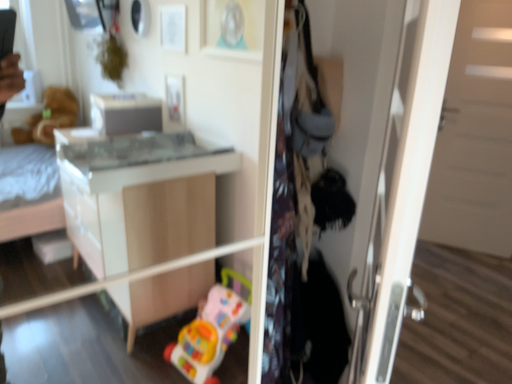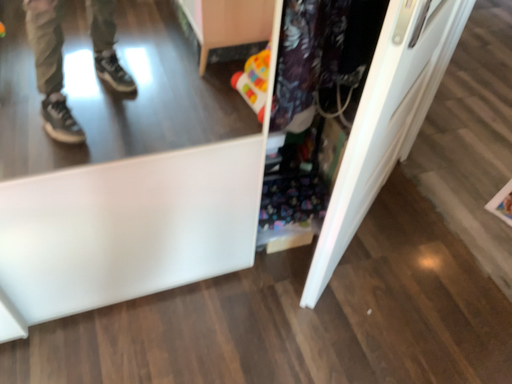
Question: How did the camera likely rotate when shooting the video?

Choices:
 (A) rotated left
 (B) rotated right

Answer: (A)